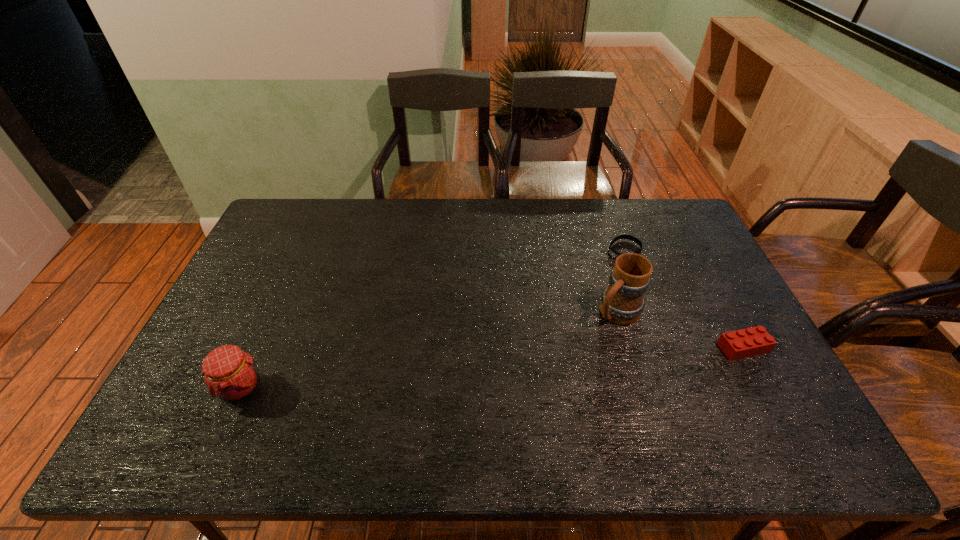
At what (x,y) coordinates should I click in order to perform the action: click on jam. Please return your answer as a coordinate pair (x, y). Looking at the image, I should click on (230, 374).

Where is `the leftmost object`? the leftmost object is located at coordinates (230, 374).

In order to click on the third farthest object in this screenshot , I will do point(753,341).

Where is `the rightmost object`? The image size is (960, 540). the rightmost object is located at coordinates (753, 341).

What are the coordinates of `the shortest object` in the screenshot? It's located at (613, 253).

Find the location of a particular element. wristband is located at coordinates (613, 253).

At what (x,y) coordinates should I click in order to perform the action: click on mug. Please return your answer as a coordinate pair (x, y). This screenshot has height=540, width=960. Looking at the image, I should click on (622, 302).

You are a GUI agent. You are given a task and a screenshot of the screen. Output one action in this format:
    pyautogui.click(x=<x>, y=<y>)
    Task: Click on the tallest object
    This screenshot has height=540, width=960.
    Given the screenshot: What is the action you would take?
    pyautogui.click(x=622, y=302)

The width and height of the screenshot is (960, 540). I want to click on free space located 0.260m on the right of the nearest object, so click(371, 388).

Where is `vacant space located on the back of the rightmost object`? Image resolution: width=960 pixels, height=540 pixels. vacant space located on the back of the rightmost object is located at coordinates (698, 262).